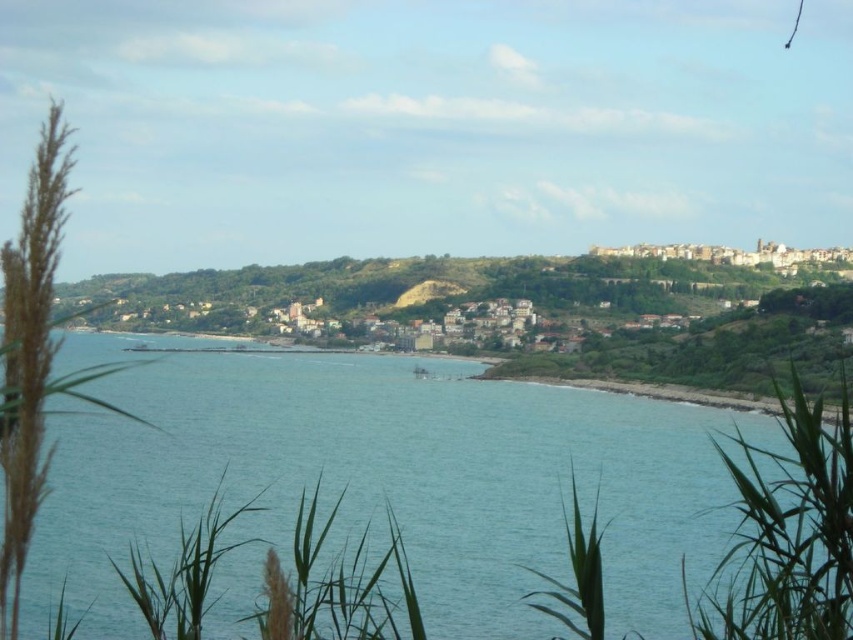
You are standing at the point with coordinates point (778, 636) and want to walk towards the point with coordinates point (529, 570). Given the coastal landscape described, will your path be obstructed by the dense vegetation in the midground?

Point (778, 636) is in front of point (529, 570), so walking from point (778, 636) towards point (529, 570) would mean moving away from the dense vegetation in the midground, so your path would not be obstructed by the dense vegetation in the midground.

You are a delivery drone that needs to fly from the green leafy plant at lower center to the clear blue water at center. The drone has a maximum flight range of 60 meters. Can it reach the destination without recharging?

The distance between the green leafy plant at lower center and the clear blue water at center is 66.52 meters, which exceeds the drone s 60 meter range. Therefore, the drone cannot reach the destination without recharging.